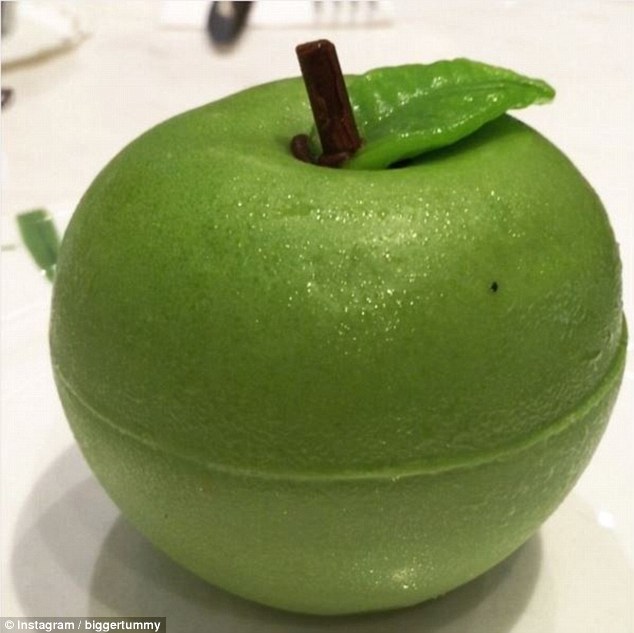
This screenshot has height=633, width=634. Find the location of `empty white space on table`. empty white space on table is located at coordinates (78, 91).